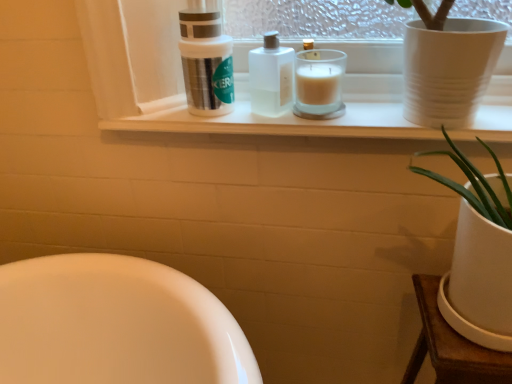
Question: From the image's perspective, is clear plastic bottle at center located above or below silver metallic container at upper center?

Choices:
 (A) below
 (B) above

Answer: (A)

Question: Relative to silver metallic container at upper center, is clear plastic bottle at center in front or behind?

Choices:
 (A) behind
 (B) front

Answer: (A)

Question: Estimate the real-world distances between objects in this image. Which object is closer to the silver metallic container at upper center?

Choices:
 (A) translucent glass candle at center
 (B) clear plastic bottle at center
 (C) white matte window sill at upper center

Answer: (B)

Question: Based on their relative distances, which object is nearer to the clear plastic bottle at center?

Choices:
 (A) silver metallic container at upper center
 (B) white matte window sill at upper center
 (C) translucent glass candle at center

Answer: (C)